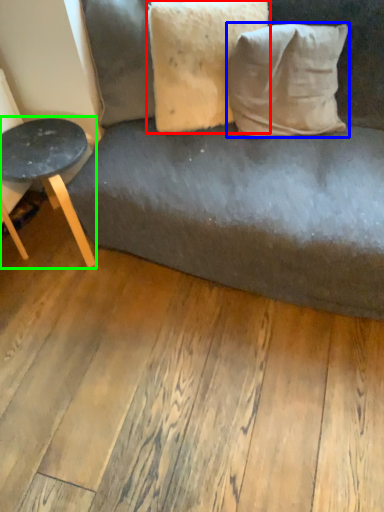
Question: Which object is positioned farthest from pillow (highlighted by a red box)? Select from pillow (highlighted by a blue box) and table (highlighted by a green box).

Choices:
 (A) pillow
 (B) table

Answer: (B)